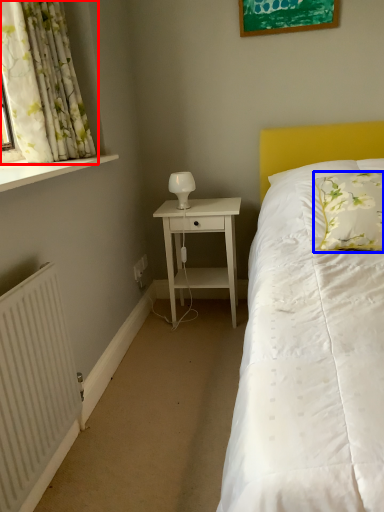
Question: Among these objects, which one is farthest to the camera, curtain (highlighted by a red box) or pillow (highlighted by a blue box)?

Choices:
 (A) curtain
 (B) pillow

Answer: (B)